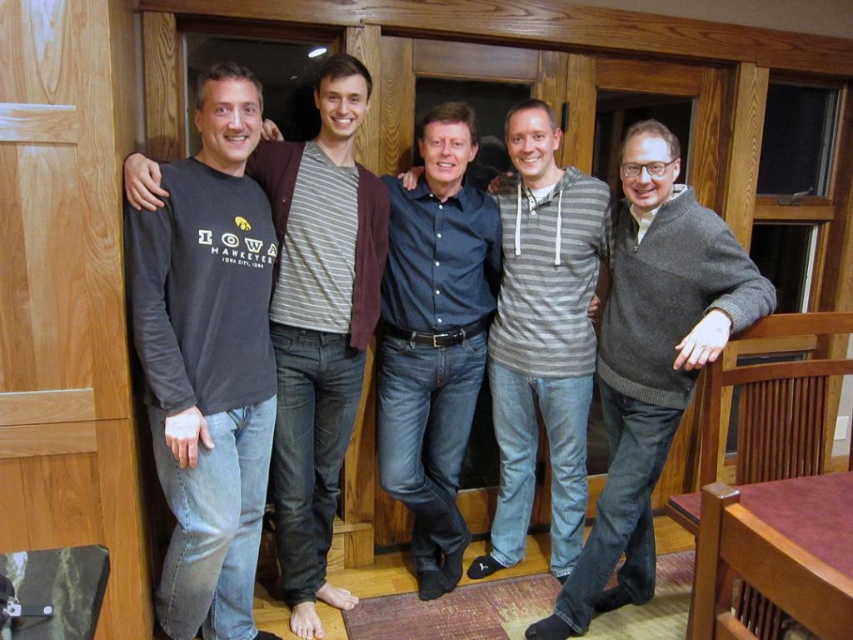
Question: Does dark gray long-sleeve shirt at left have a greater width compared to dark gray sweater at right?

Choices:
 (A) yes
 (B) no

Answer: (B)

Question: Which point appears closest to the camera in this image?

Choices:
 (A) (297, 371)
 (B) (570, 273)

Answer: (A)

Question: Which point is farther from the camera taking this photo?

Choices:
 (A) (248, 170)
 (B) (579, 604)

Answer: (B)

Question: Among these objects, which one is farthest from the camera?

Choices:
 (A) dark gray long-sleeve shirt at left
 (B) dark gray sweater at right
 (C) dark blue shirt at center

Answer: (C)

Question: Can you confirm if dark gray long-sleeve shirt at left is wider than dark blue shirt at center?

Choices:
 (A) yes
 (B) no

Answer: (B)

Question: Is dark gray long-sleeve shirt at left smaller than dark blue shirt at center?

Choices:
 (A) yes
 (B) no

Answer: (A)